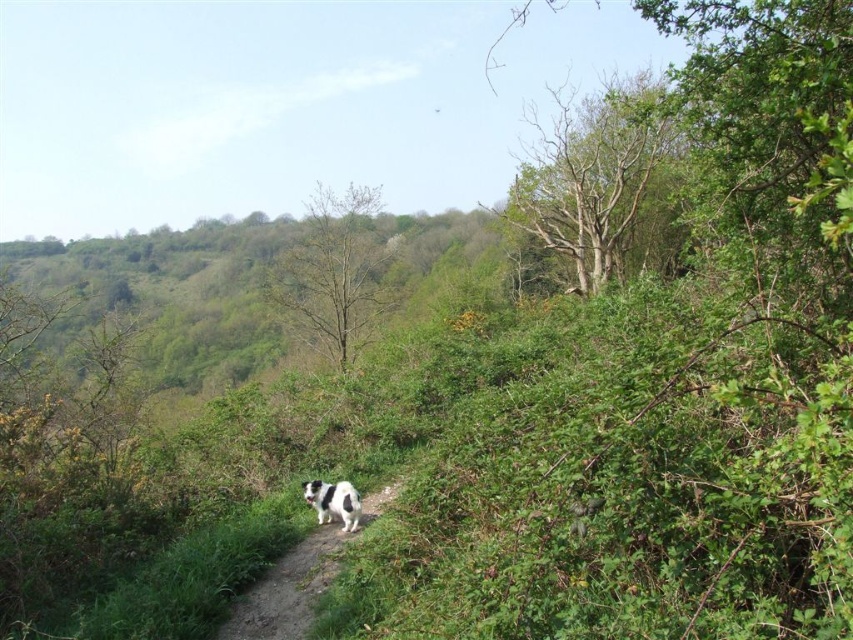
Question: Can you confirm if white fur dog at center is bigger than black and white fur dog at center?

Choices:
 (A) no
 (B) yes

Answer: (B)

Question: Which point appears closest to the camera in this image?

Choices:
 (A) (346, 497)
 (B) (323, 548)

Answer: (B)

Question: Can you confirm if white fur dog at center is thinner than black and white fur dog at center?

Choices:
 (A) no
 (B) yes

Answer: (A)

Question: Is white fur dog at center thinner than black and white fur dog at center?

Choices:
 (A) no
 (B) yes

Answer: (A)

Question: Which point is closer to the camera taking this photo?

Choices:
 (A) (293, 579)
 (B) (352, 515)

Answer: (A)